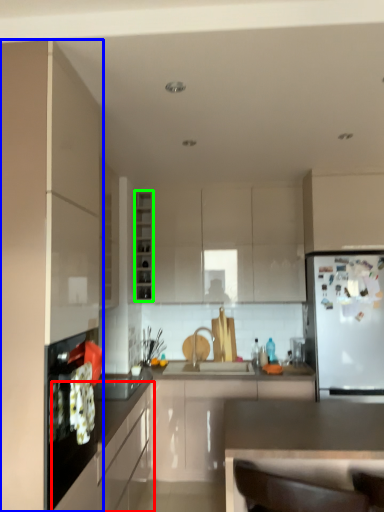
Question: Based on their relative distances, which object is nearer to cabinetry (highlighted by a red box)? Choose from cabinetry (highlighted by a blue box) and cabinetry (highlighted by a green box).

Choices:
 (A) cabinetry
 (B) cabinetry

Answer: (A)